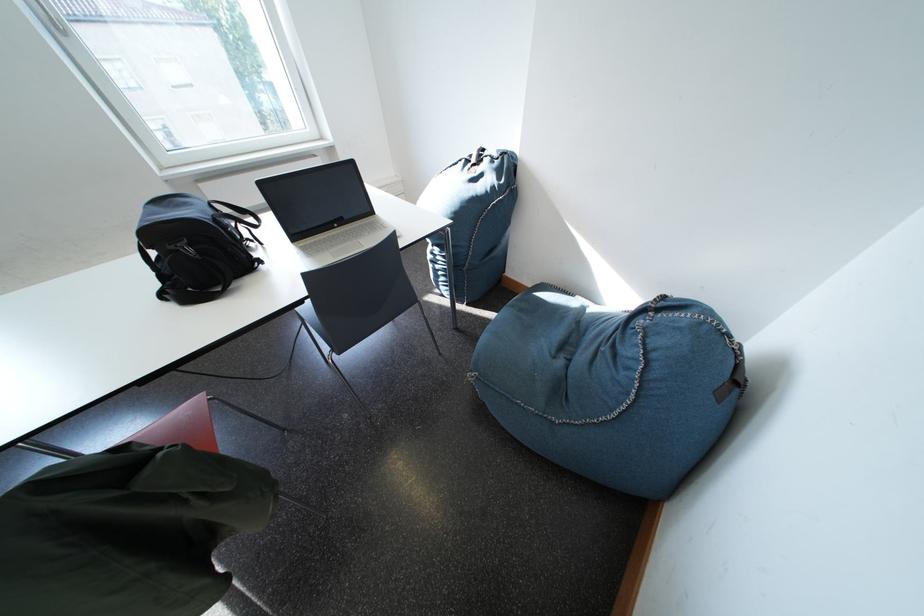
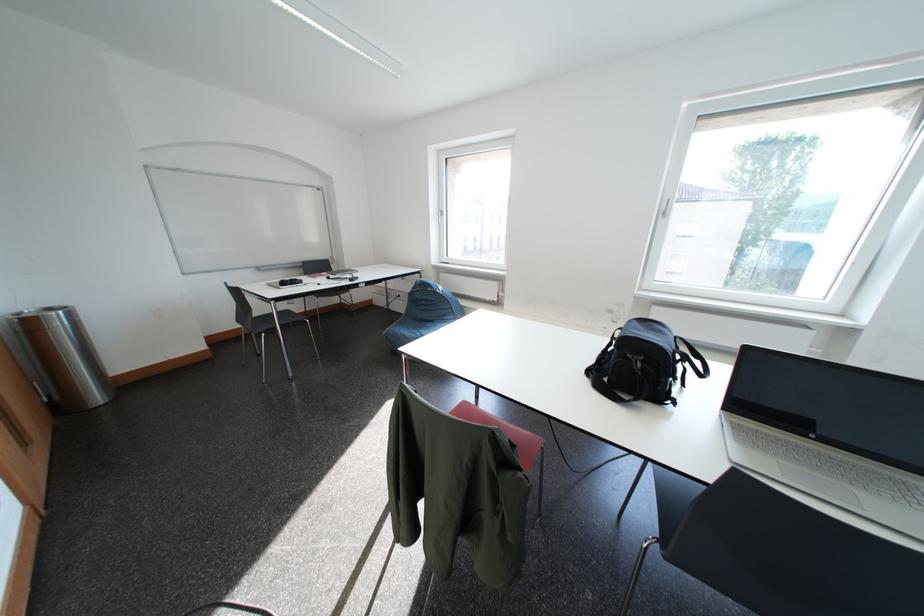
Find the pixel in the second image that matches (x=130, y=452) in the first image.

(525, 450)